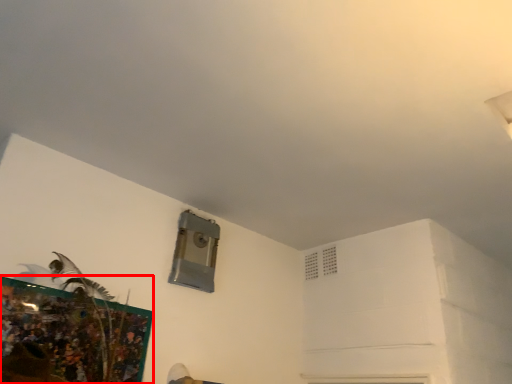
Question: Considering the relative positions of picture frame (annotated by the red box) and air conditioning in the image provided, where is picture frame (annotated by the red box) located with respect to the staircase?

Choices:
 (A) left
 (B) right

Answer: (A)